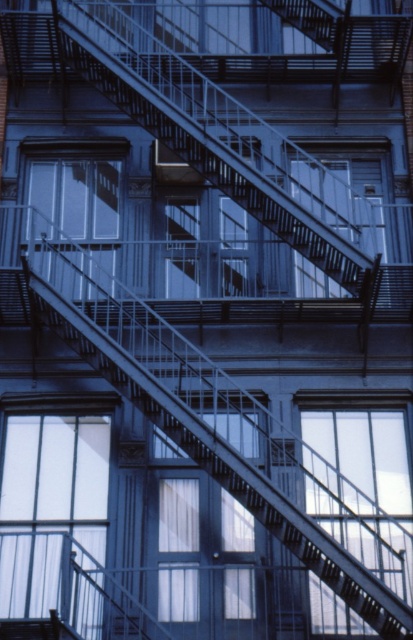
I want to click on metallic staircase at center, so click(223, 140).

Is point (258, 157) positioned behind point (37, 579)?

Yes, point (258, 157) is behind point (37, 579).

Is point (242, 180) in front of point (61, 611)?

No.

You are a GUI agent. You are given a task and a screenshot of the screen. Output one action in this format:
    pyautogui.click(x=<x>, y=<y>)
    Task: Click on the metallic staircase at center
    
    Given the screenshot: What is the action you would take?
    pyautogui.click(x=223, y=140)

Who is shorter, metallic staircase at center or clear glass window at center?

clear glass window at center is shorter.

Can you confirm if metallic staircase at center is positioned below clear glass window at center?

No, metallic staircase at center is not below clear glass window at center.

Which is behind, point (161, 68) or point (339, 461)?

Positioned behind is point (161, 68).

Locate an element on the screen. metallic staircase at center is located at coordinates (223, 140).

Does clear glass window at lower left have a larger size compared to metallic fire escape at upper center?

No, clear glass window at lower left is not bigger than metallic fire escape at upper center.

Which is above, clear glass window at lower left or metallic fire escape at upper center?

metallic fire escape at upper center

The width and height of the screenshot is (413, 640). What are the coordinates of `clear glass window at lower left` in the screenshot? It's located at (49, 506).